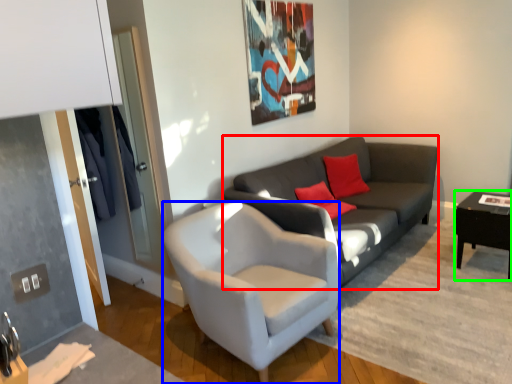
Question: Estimate the real-world distances between objects in this image. Which object is closer to studio couch (highlighted by a red box), chair (highlighted by a blue box) or table (highlighted by a green box)?

Choices:
 (A) chair
 (B) table

Answer: (A)